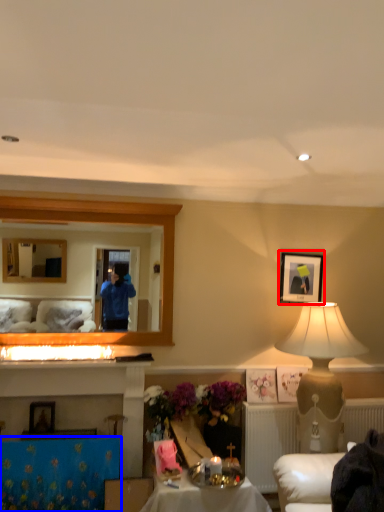
Question: Among these objects, which one is nearest to the camera, picture frame (highlighted by a red box) or tablecloth (highlighted by a blue box)?

Choices:
 (A) picture frame
 (B) tablecloth

Answer: (B)